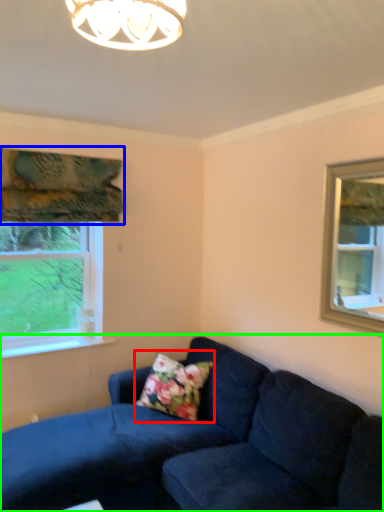
Question: Estimate the real-world distances between objects in this image. Which object is closer to pillow (highlighted by a red box), curtain (highlighted by a blue box) or studio couch (highlighted by a green box)?

Choices:
 (A) curtain
 (B) studio couch

Answer: (B)